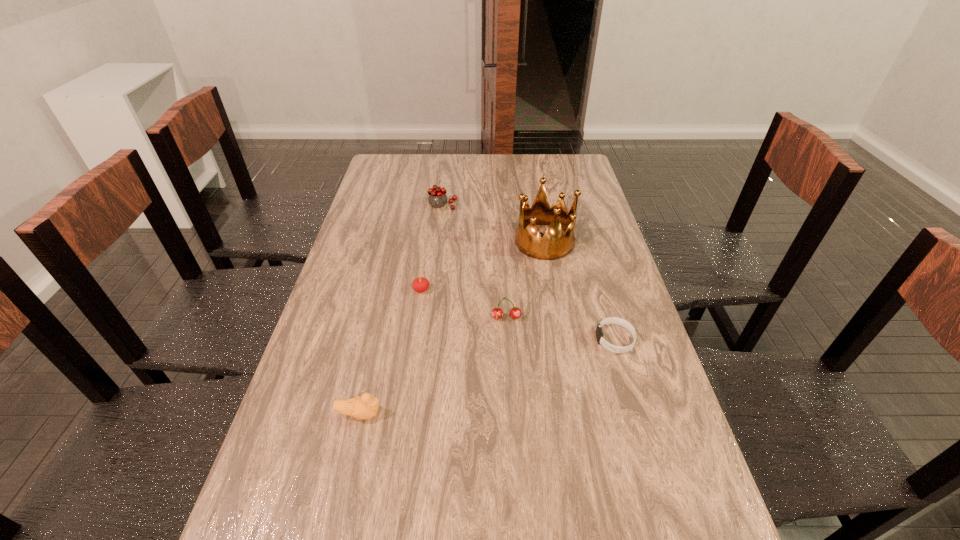
At what (x,y) coordinates should I click in order to perform the action: click on empty location between the nearest object and the fourth nearest object. Please return your answer as a coordinate pair (x, y). Looking at the image, I should click on (391, 352).

In order to click on vacant space that is in between the fifth farthest object and the farthest cherry in this screenshot , I will do `click(529, 273)`.

The image size is (960, 540). I want to click on empty location between the tallest object and the fifth shortest object, so click(x=493, y=224).

Where is `free space between the wristband and the nearest cherry`? This screenshot has height=540, width=960. free space between the wristband and the nearest cherry is located at coordinates (561, 328).

Where is `vacant area that lies between the fifth shortest object and the nearest object`? The image size is (960, 540). vacant area that lies between the fifth shortest object and the nearest object is located at coordinates (401, 310).

Locate an element on the screen. empty space that is in between the fifth farthest object and the tallest cherry is located at coordinates (529, 273).

Identify which object is the second closest to the farthest cherry. Please provide its 2D coordinates. Your answer should be formatted as a tuple, i.e. [(x, y)], where the tuple contains the x and y coordinates of a point satisfying the conditions above.

[(421, 284)]

In order to click on object that is the fourth nearest to the crown in this screenshot , I will do `click(421, 284)`.

The width and height of the screenshot is (960, 540). Identify the location of cherry that is the closest to the third object from right to left. (421, 284).

The image size is (960, 540). In order to click on the closest cherry to the wristband in this screenshot , I will do `click(497, 313)`.